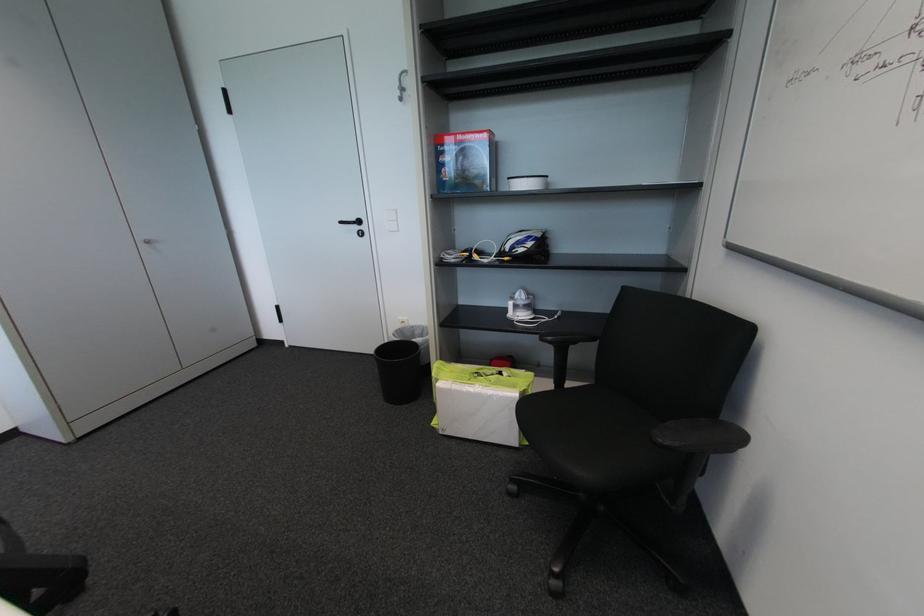
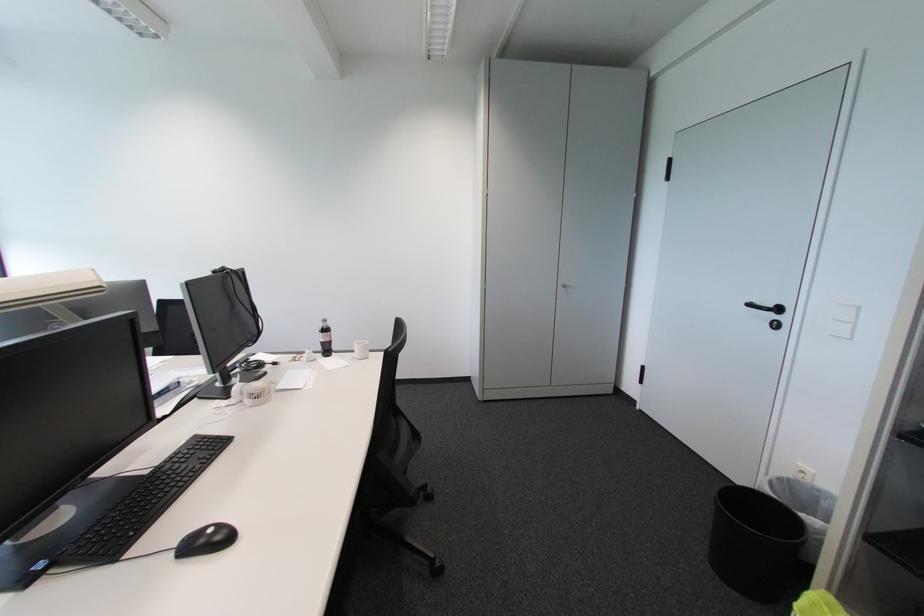
The point at (362, 229) is marked in the first image. Where is the corresponding point in the second image?

(777, 317)